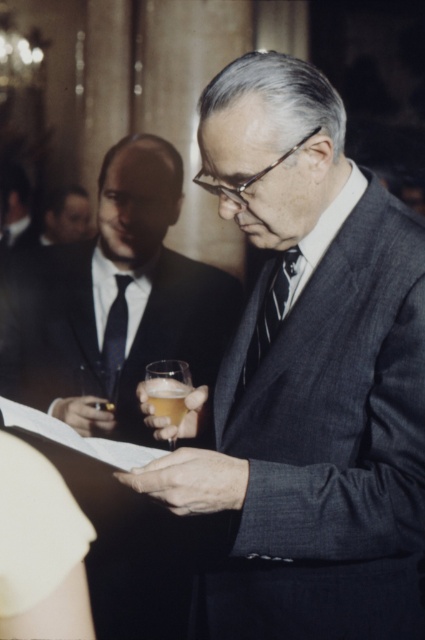
Question: Which point is farther to the camera?

Choices:
 (A) dark suit at center
 (B) matte glass beer at center
 (C) striped fabric tie at center

Answer: (A)

Question: Can you confirm if gray wool suit at center is positioned to the right of dark suit at center?

Choices:
 (A) no
 (B) yes

Answer: (B)

Question: Which point appears closest to the camera in this image?

Choices:
 (A) (246, 378)
 (B) (195, 472)
 (C) (215, 346)
 (D) (20, 177)

Answer: (B)

Question: Can you confirm if gray wool suit at center is wider than matte glass beer at center?

Choices:
 (A) yes
 (B) no

Answer: (B)

Question: Can you confirm if dark suit at center is wider than translucent glass at center?

Choices:
 (A) no
 (B) yes

Answer: (B)

Question: Which of the following is the farthest from the observer?

Choices:
 (A) (22, 188)
 (B) (227, 630)

Answer: (A)